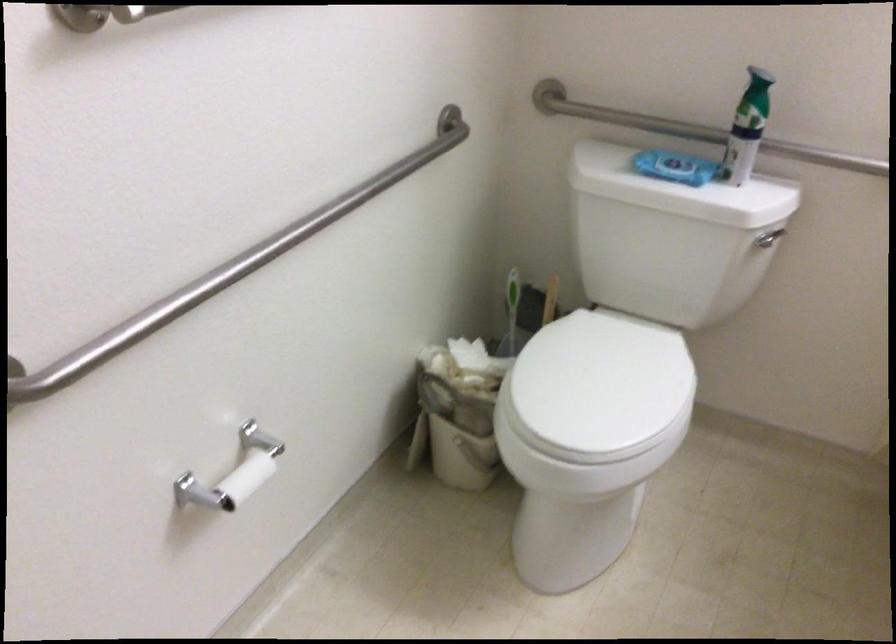
This screenshot has width=896, height=644. Find the location of `blue wipes package`. blue wipes package is located at coordinates point(675,167).